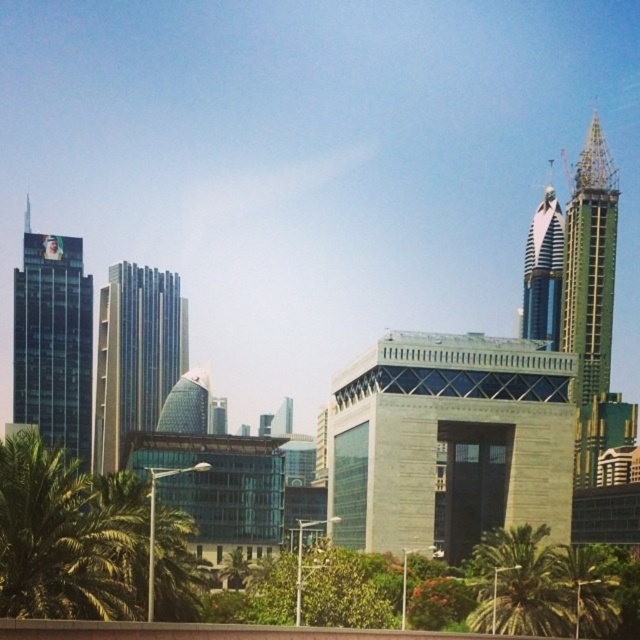
Is green leafy palm tree at lower left bigger than green glass tower at upper right?

Incorrect, green leafy palm tree at lower left is not larger than green glass tower at upper right.

Which is more to the left, green leafy palm tree at lower left or green glass tower at upper right?

green leafy palm tree at lower left

Is point (60, 488) farther from camera compared to point (586, 280)?

No, it is in front of (586, 280).

Locate an element on the screen. The height and width of the screenshot is (640, 640). green leafy palm tree at lower left is located at coordinates (60, 538).

Is point (596, 172) closer to camera compared to point (588, 618)?

No, (596, 172) is behind (588, 618).

Is green glass tower at upper right positioned at the back of green leafy palm tree at lower right?

Yes.

Where is `green glass tower at upper right`? This screenshot has width=640, height=640. green glass tower at upper right is located at coordinates (589, 264).

Looking at this image, is green leafy palm tree at lower left to the right of glass skyscraper at upper right from the viewer's perspective?

Incorrect, green leafy palm tree at lower left is not on the right side of glass skyscraper at upper right.

Is green leafy palm tree at lower left smaller than glass skyscraper at upper right?

Correct, green leafy palm tree at lower left occupies less space than glass skyscraper at upper right.

Measure the distance between point (80, 602) and camera.

They are 75.54 meters apart.

Find the location of a particular element. The width and height of the screenshot is (640, 640). green leafy palm tree at lower left is located at coordinates (60, 538).